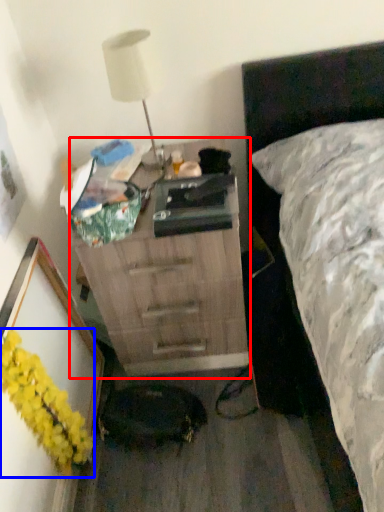
Question: Which object appears farthest to the camera in this image, chest of drawers (highlighted by a red box) or flower (highlighted by a blue box)?

Choices:
 (A) chest of drawers
 (B) flower

Answer: (A)